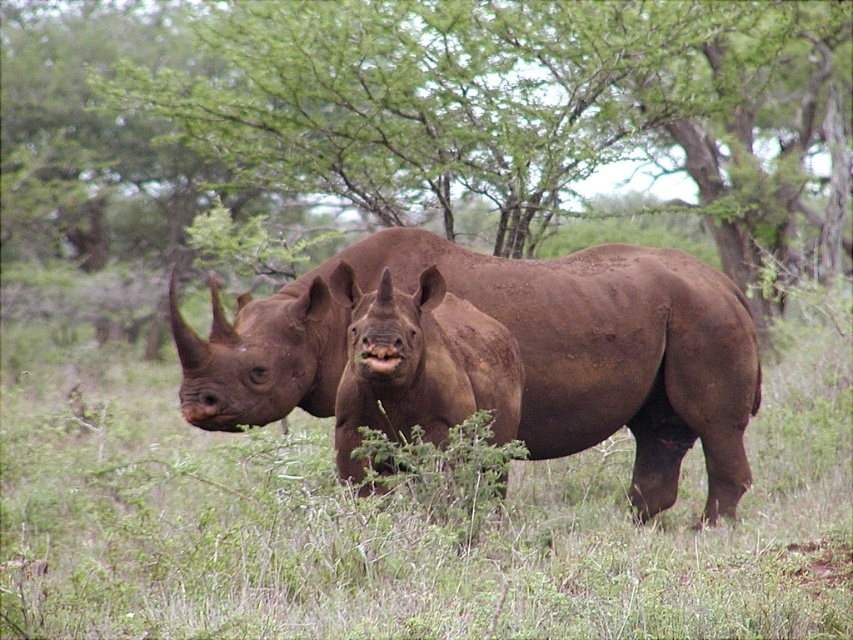
Question: Among these objects, which one is nearest to the camera?

Choices:
 (A) matte brown rhino at center
 (B) green leafy tree at center
 (C) brown matte rhinoceros at center

Answer: (A)

Question: Considering the real-world distances, which object is farthest from the green leafy tree at center?

Choices:
 (A) matte brown rhino at center
 (B) brown matte rhinoceros at center

Answer: (A)

Question: Is green leafy tree at center below matte brown rhino at center?

Choices:
 (A) yes
 (B) no

Answer: (B)

Question: Is green leafy tree at center bigger than brown matte rhinoceros at center?

Choices:
 (A) no
 (B) yes

Answer: (B)

Question: Where is green leafy tree at center located in relation to matte brown rhino at center in the image?

Choices:
 (A) below
 (B) above

Answer: (B)

Question: Which object is closer to the camera taking this photo?

Choices:
 (A) brown matte rhinoceros at center
 (B) matte brown rhino at center
 (C) green leafy tree at center

Answer: (B)